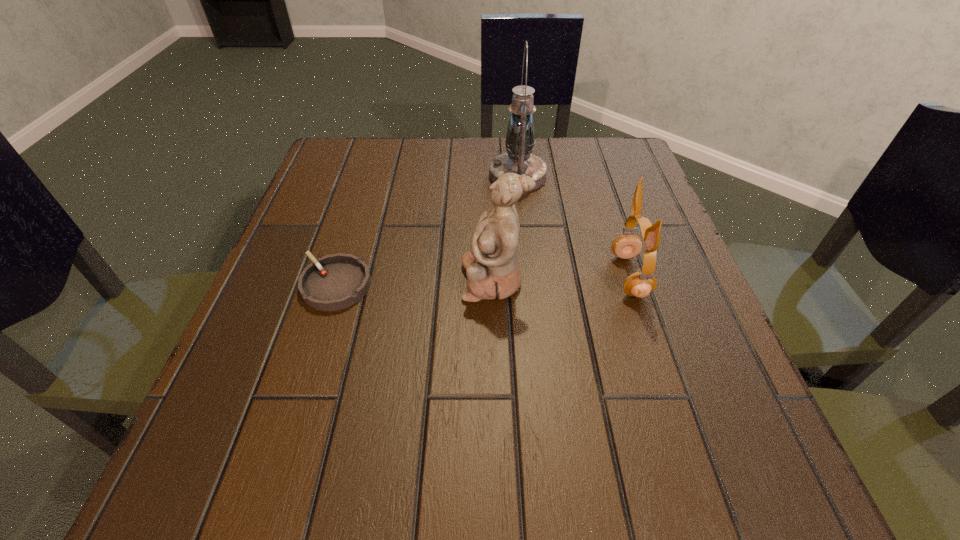
Identify the location of free space at the left edge. This screenshot has height=540, width=960. (283, 258).

Find the location of a particular element. vacant space at the right edge of the desktop is located at coordinates (675, 372).

Locate an element on the screen. vacant region at the far left corner of the desktop is located at coordinates (358, 180).

The image size is (960, 540). I want to click on free space at the far right corner, so click(598, 192).

The height and width of the screenshot is (540, 960). I want to click on vacant space at the near right corner of the desktop, so click(x=718, y=443).

This screenshot has height=540, width=960. I want to click on free space between the figurine and the leftmost object, so click(x=415, y=282).

Where is `vacant region between the second tallest object and the rightmost object`? vacant region between the second tallest object and the rightmost object is located at coordinates (562, 278).

The width and height of the screenshot is (960, 540). In order to click on free spot between the earphone and the second tallest object in this screenshot , I will do `click(562, 278)`.

Locate an element on the screen. vacant region between the third tallest object and the third shortest object is located at coordinates (562, 278).

Locate an element on the screen. This screenshot has height=540, width=960. vacant space that's between the third tallest object and the third shortest object is located at coordinates (562, 278).